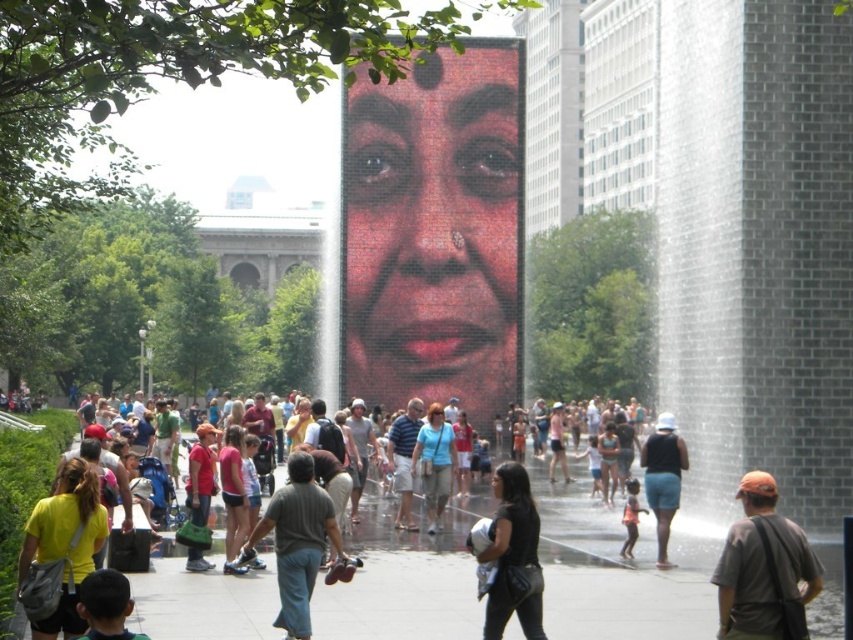
You are standing in the public square and want to take a photo of the mural. You notice two points marked on the structure where you can attach a light. The points are labeled as point 1 at (647, 609) and point 2 at (498, 497). If you want the light to be closer to the viewer, which point should you choose?

Point 1 at (647, 609) is further to the viewer than point 2 at (498, 497), so you should choose point 1 at (647, 609) to place the light closer to the viewer.

You are standing in the park and want to take a photo of the matte red face at center and the yellow fabric shirt at lower left. Which object will appear larger in your photo?

The matte red face at center will appear larger in your photo because it is closer to you than the yellow fabric shirt at lower left.

You are standing at the point with coordinates point (33, 593) and want to walk to the point with coordinates point (413, 326). Is the destination point behind you or in front of you?

The destination point (413, 326) is behind point (33, 593), so it is behind you.